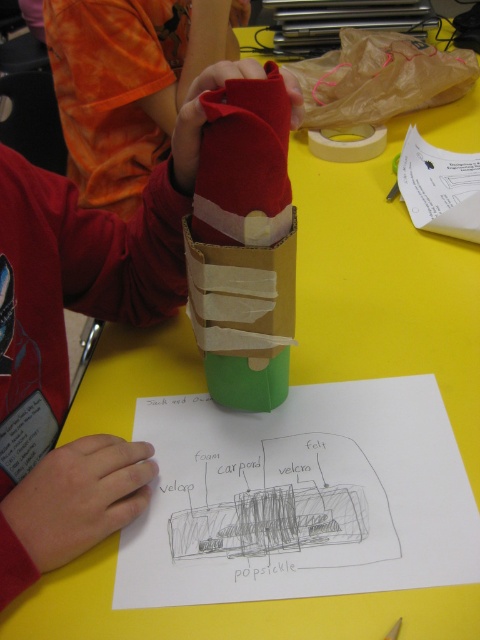
Can you confirm if white paper at center is bigger than brown paper bag at upper center?

Incorrect, white paper at center is not larger than brown paper bag at upper center.

Image resolution: width=480 pixels, height=640 pixels. What are the coordinates of `white paper at center` in the screenshot? It's located at (300, 497).

In the scene shown: Does orange tie-dye shirt at upper left have a lesser width compared to white paper at upper right?

In fact, orange tie-dye shirt at upper left might be wider than white paper at upper right.

Can you confirm if orange tie-dye shirt at upper left is positioned to the left of white paper at upper right?

Indeed, orange tie-dye shirt at upper left is positioned on the left side of white paper at upper right.

Does point (183, 93) come closer to viewer compared to point (405, 179)?

No.

At what (x,y) coordinates should I click in order to perform the action: click on orange tie-dye shirt at upper left. Please return your answer as a coordinate pair (x, y). The height and width of the screenshot is (640, 480). Looking at the image, I should click on (128, 83).

Is brown paper bag at upper center wider than white paper at upper right?

Correct, the width of brown paper bag at upper center exceeds that of white paper at upper right.

Measure the distance between brown paper bag at upper center and white paper at upper right.

brown paper bag at upper center and white paper at upper right are 8.27 inches apart from each other.

Which is behind, point (336, 97) or point (408, 132)?

The point (336, 97) is more distant.

Where is `brown paper bag at upper center`? This screenshot has height=640, width=480. brown paper bag at upper center is located at coordinates (380, 77).